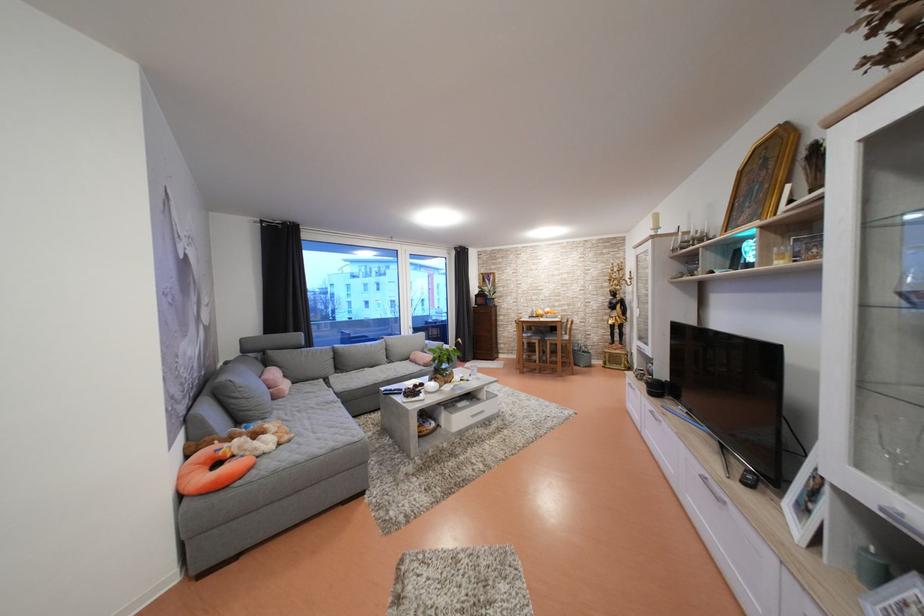
Find the location of a particular element. white pillar candle is located at coordinates (653, 223).